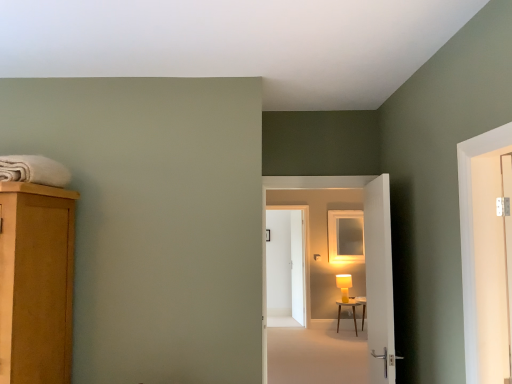
Question: Considering the positions of point (360, 304) and point (339, 215), is point (360, 304) closer or farther from the camera than point (339, 215)?

Choices:
 (A) farther
 (B) closer

Answer: (B)

Question: Is wooden side table at center to the left or to the right of matte white medicine cabinet at center in the image?

Choices:
 (A) right
 (B) left

Answer: (B)

Question: Based on their relative distances, which object is farther from the wooden side table at center?

Choices:
 (A) white glossy door at center, marked as the 2th door in a back-to-front arrangement
 (B) white soft towel at upper left
 (C) white wooden door at center, which appears as the third door when viewed from the front
 (D) white glossy screen door at right, which appears as the second screen door when viewed from the back
 (E) white glossy door at center-right, which ranks as the 1th door in front-to-back order

Answer: (B)

Question: Estimate the real-world distances between objects in this image. Which object is closer to the white glossy door at center, the 2th door from the front?

Choices:
 (A) matte white medicine cabinet at center
 (B) wooden side table at center
 (C) white glossy screen door at right, which is the 1th screen door from front to back
 (D) white soft towel at upper left
 (E) white wooden door at center, which ranks as the 1th door in back-to-front order

Answer: (C)